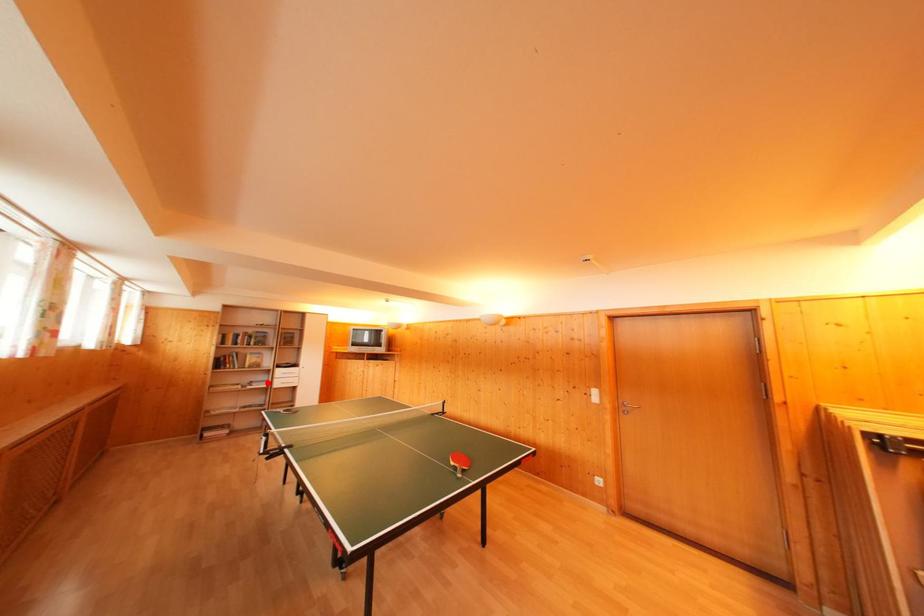
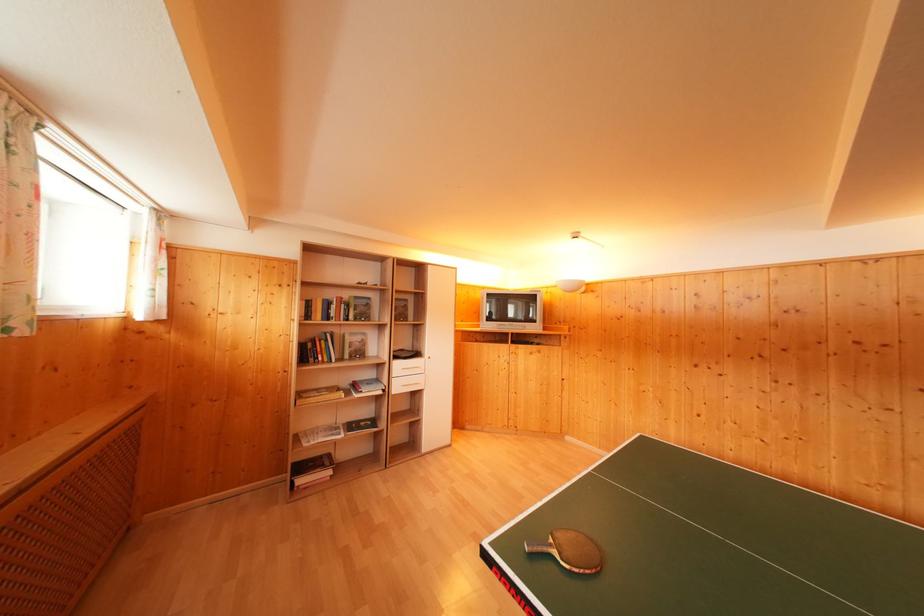
Locate, in the second image, the point that corresponds to the highlighted location in the first image.

(375, 379)